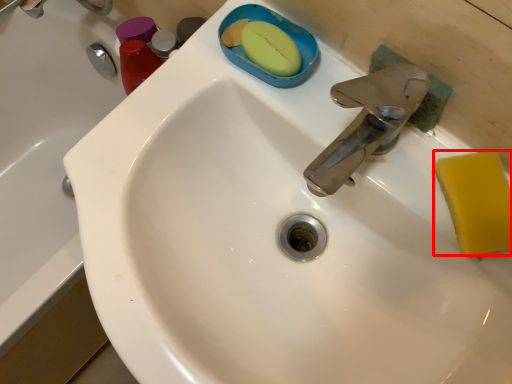
Question: From the image's perspective, where is soap (annotated by the red box) located in relation to bath in the image?

Choices:
 (A) below
 (B) above

Answer: (B)